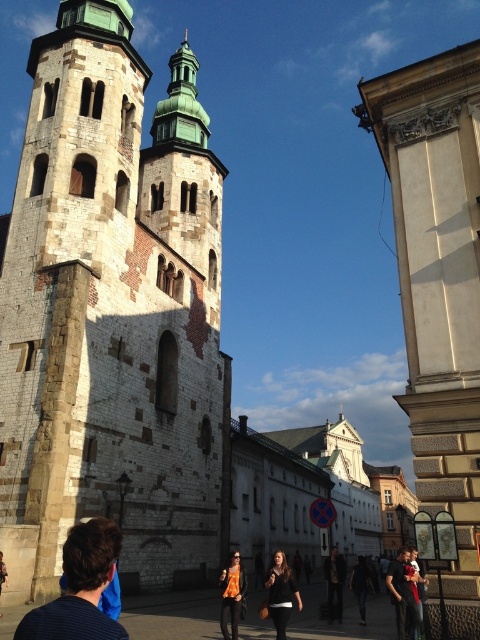
Is the position of white stone column at upper right less distant than that of dark brown leather jacket at lower center?

Yes, it is.

From the picture: Measure the distance between white stone column at upper right and dark brown leather jacket at lower center.

A distance of 16.34 meters exists between white stone column at upper right and dark brown leather jacket at lower center.

Who is more forward, (404,259) or (285,598)?

Point (285,598) is more forward.

This screenshot has width=480, height=640. In order to click on white stone column at upper right in this screenshot , I will do `click(439, 292)`.

From the picture: Can you confirm if dark blue shirt at lower left is positioned above dark blue shirt at center?

Yes, dark blue shirt at lower left is above dark blue shirt at center.

Can you confirm if dark blue shirt at lower left is thinner than dark blue shirt at center?

No.

Image resolution: width=480 pixels, height=640 pixels. Describe the element at coordinates (80, 588) in the screenshot. I see `dark blue shirt at lower left` at that location.

This screenshot has width=480, height=640. Find the location of `dark blue shirt at lower left`. dark blue shirt at lower left is located at coordinates (80, 588).

Is matte black jacket at center closer to the viewer compared to orange fabric shirt at center?

Yes, it is.

Does matte black jacket at center have a smaller size compared to orange fabric shirt at center?

Yes, matte black jacket at center is smaller than orange fabric shirt at center.

Who is more distant from viewer, (406, 602) or (223, 612)?

Positioned behind is point (223, 612).

Find the location of a particular element. This screenshot has height=640, width=480. matte black jacket at center is located at coordinates (404, 593).